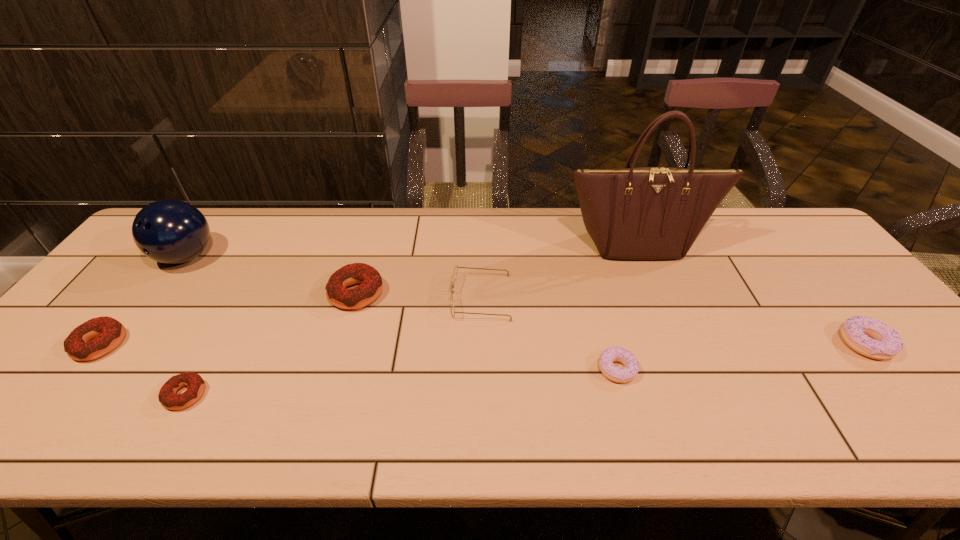
Where is `the leftmost chocolate doughnut`? This screenshot has width=960, height=540. the leftmost chocolate doughnut is located at coordinates (109, 332).

Locate an element on the screen. The width and height of the screenshot is (960, 540). the fourth doughnut from left to right is located at coordinates (631, 367).

Image resolution: width=960 pixels, height=540 pixels. Identify the location of the left purple doughnut. (631, 367).

In order to click on the nearest chocolate doughnut in this screenshot , I will do `click(195, 384)`.

Find the location of `the fourth doughnut from right to left`. the fourth doughnut from right to left is located at coordinates (195, 384).

Locate an element on the screen. This screenshot has height=540, width=960. free space located 0.150m on the front-facing side of the tallest object is located at coordinates (660, 299).

Locate an element on the screen. This screenshot has width=960, height=540. free location located on the surface of the bowling ball near the finger holes is located at coordinates (134, 326).

The height and width of the screenshot is (540, 960). Identify the location of vacant space located on the front of the fourth object from left to right. (323, 410).

Where is `vacant space situated 0.210m on the front-facing side of the fourth object from right to left`? The height and width of the screenshot is (540, 960). vacant space situated 0.210m on the front-facing side of the fourth object from right to left is located at coordinates (373, 298).

The height and width of the screenshot is (540, 960). Identify the location of vacant space located on the front-facing side of the fourth object from right to left. (418, 298).